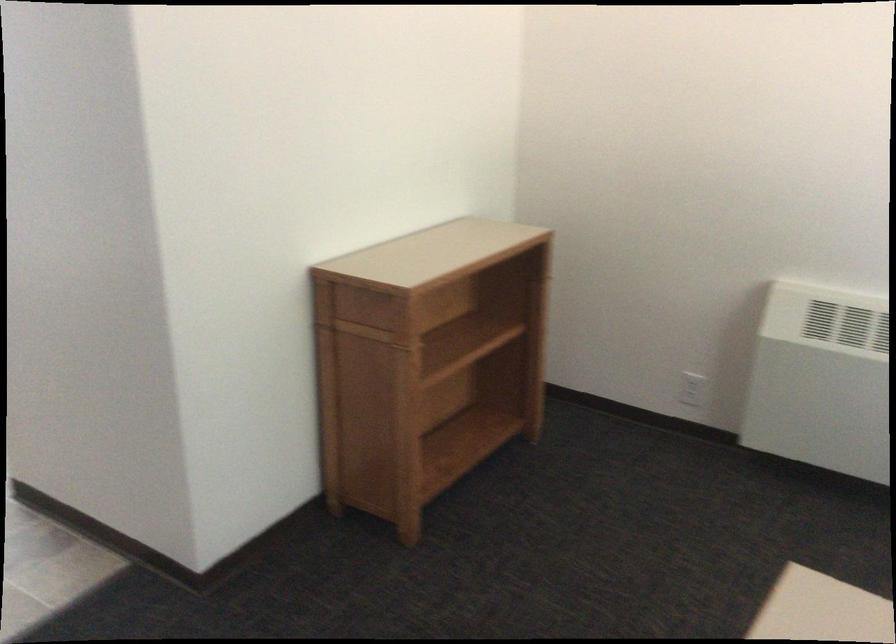
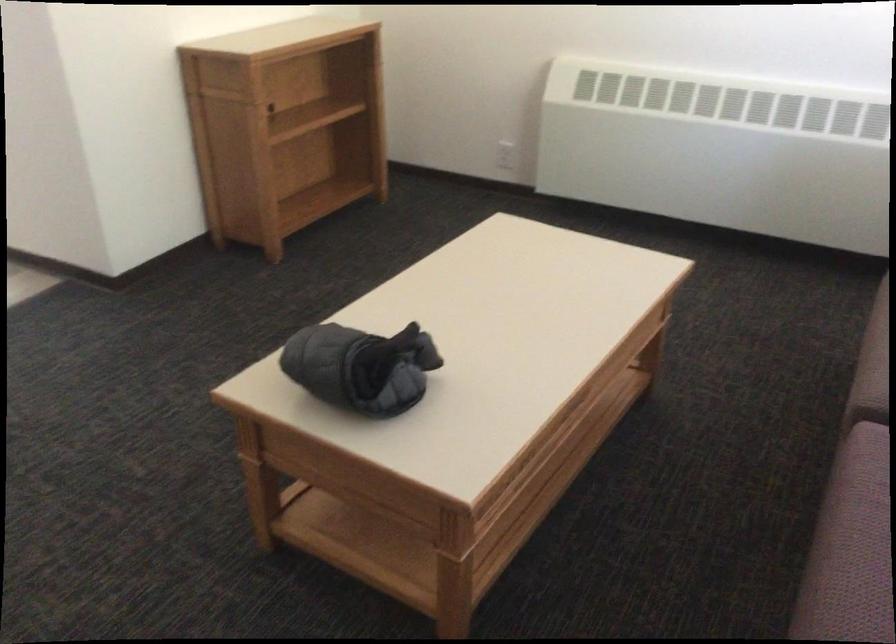
The point at (695, 388) is marked in the first image. Where is the corresponding point in the second image?

(505, 155)